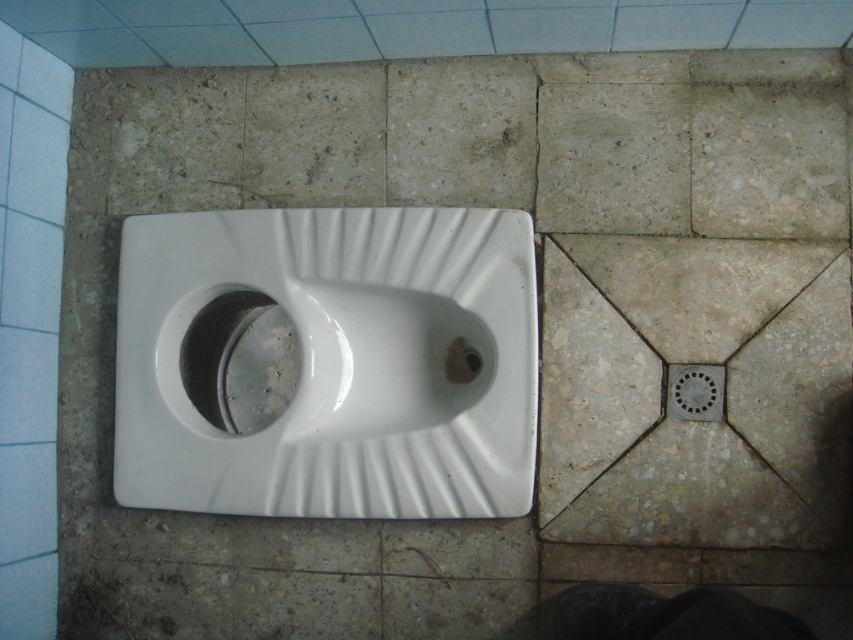
You are a maintenance worker inspecting the restroom facilities. You need to determine which object requires immediate attention based on their sizes. The white glossy urinal at center has a visible crack, and the matte metallic drain at lower right is clogged. Which one should you prioritize fixing first?

The white glossy urinal at center should be prioritized because it is larger in size than the matte metallic drain at lower right, making the crack more noticeable and potentially hazardous.

You are a maintenance worker inspecting a restroom. You need to clean both the white glossy urinal at center and the matte metallic drain at lower right. Based on their positions, which one should you clean first to avoid having to move the ladder?

You should clean the white glossy urinal at center first because it is located above the matte metallic drain at lower right, so you can reach the urinal from the ladder and then move down to the drain without needing to reposition it.

You are a plumber checking the bathroom facilities. You need to determine if the white glossy urinal at center can be placed over the black rubber drain at center. Based on their sizes, can the urinal fit over the drain?

The white glossy urinal at center might be wider than black rubber drain at center, so it may not fit properly over the drain.